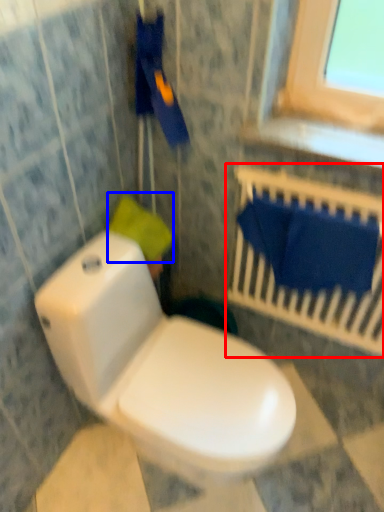
Question: Which object is closer to the camera taking this photo, balustrade (highlighted by a red box) or toilet paper (highlighted by a blue box)?

Choices:
 (A) balustrade
 (B) toilet paper

Answer: (A)